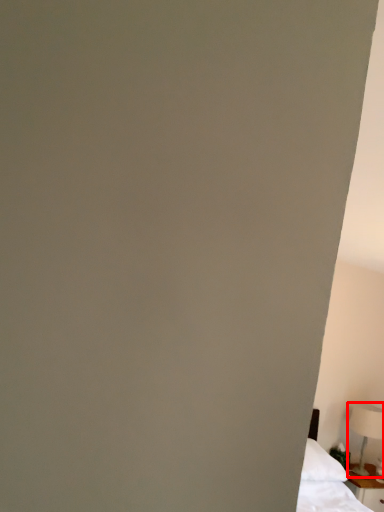
Question: From the image's perspective, what is the correct spatial positioning of table lamp (annotated by the red box) in reference to nightstand?

Choices:
 (A) below
 (B) above

Answer: (B)